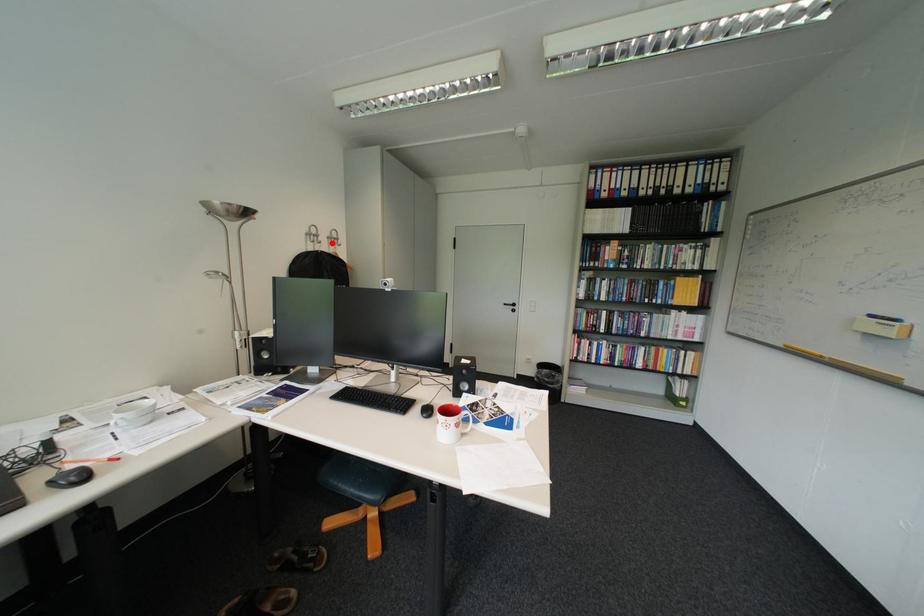
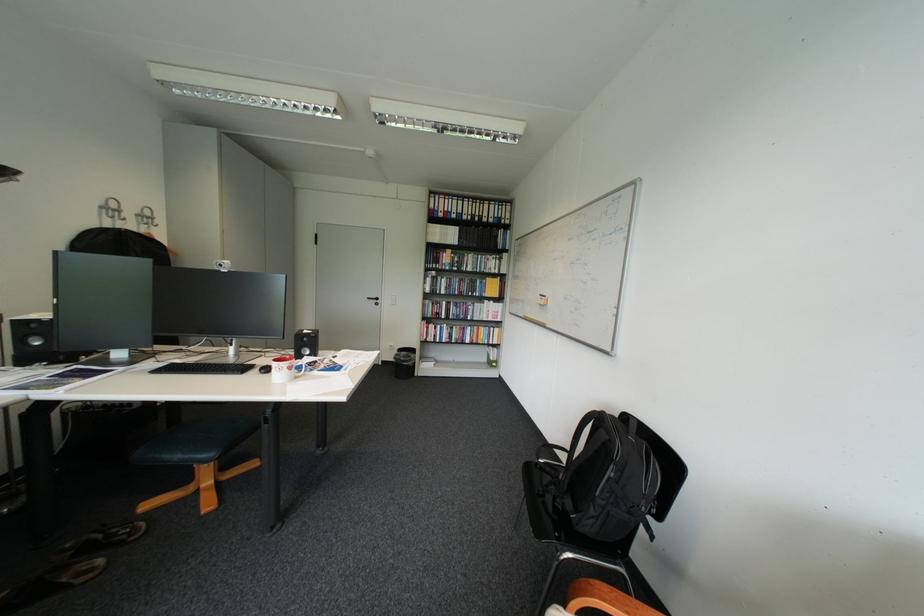
Question: A red point is marked in image1. In image2, is the corresponding 3D point closer to the camera or farther? Reply with the corresponding letter.

Choices:
 (A) The corresponding 3D point is closer.
 (B) The corresponding 3D point is farther.

Answer: (B)